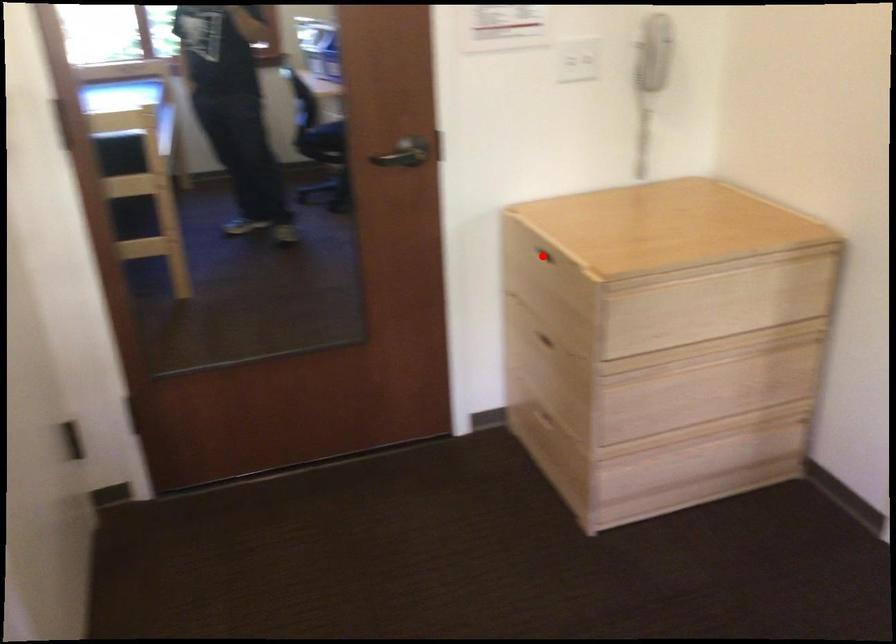
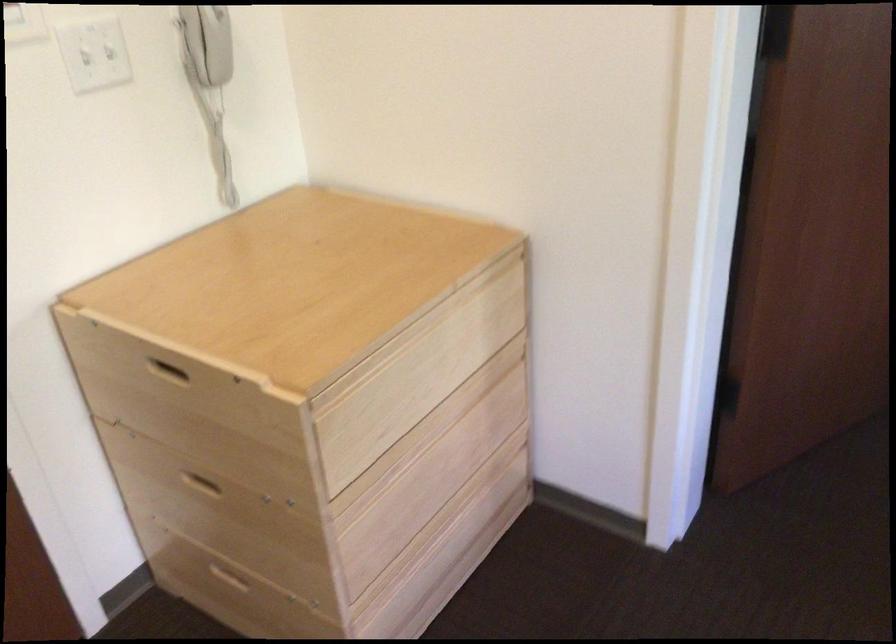
Locate, in the second image, the point that corresponds to the highlighted location in the first image.

(168, 372)